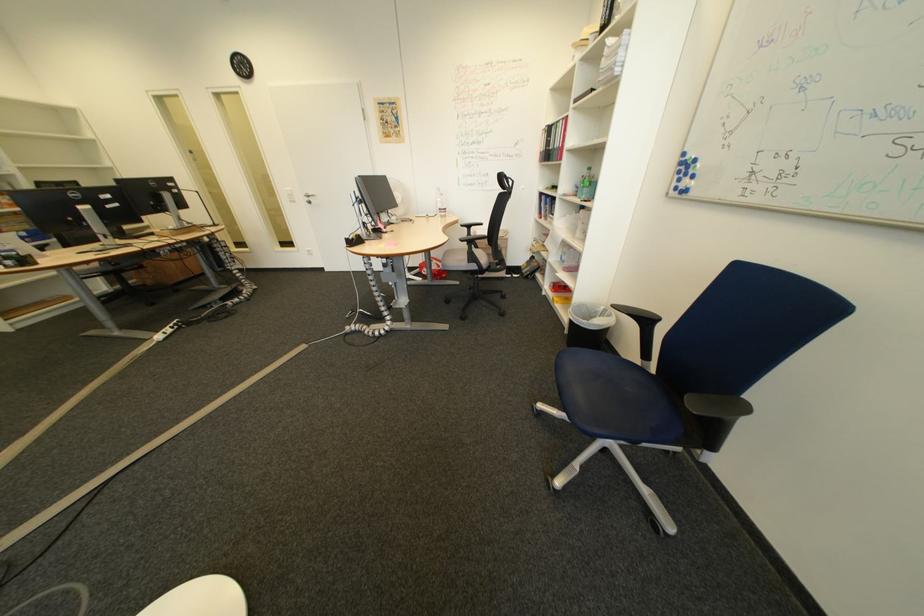
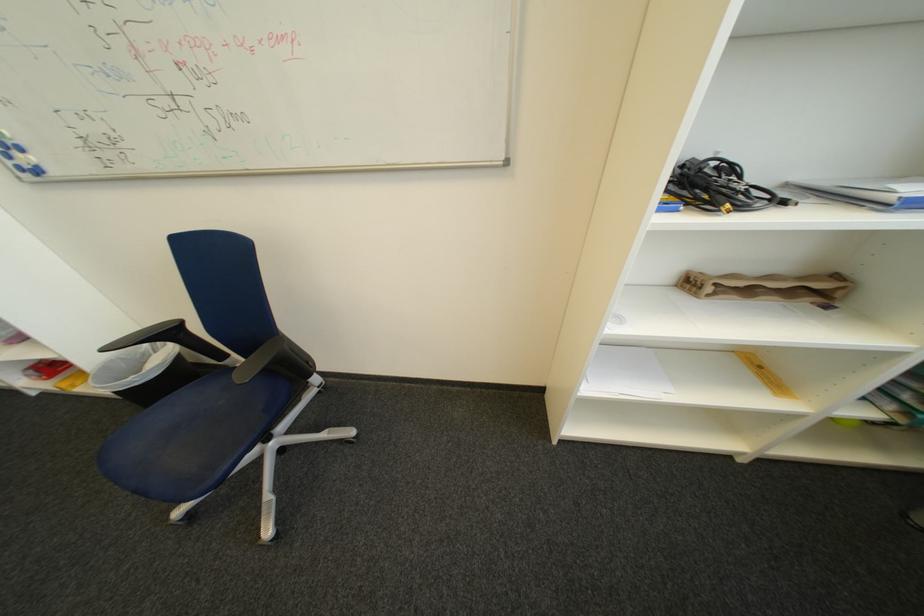
The point at [660,322] is marked in the first image. Where is the corresponding point in the second image?

(185, 334)